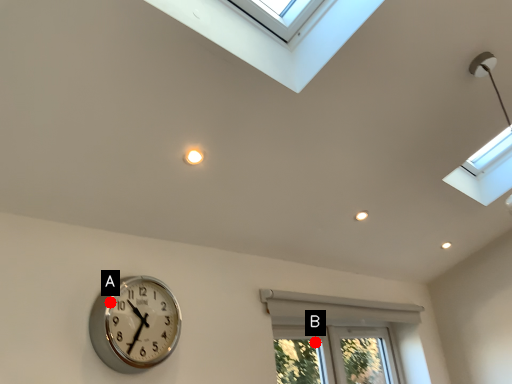
Question: Two points are circled on the image, labeled by A and B beside each circle. Which point appears closest to the camera in this image?

Choices:
 (A) A is closer
 (B) B is closer

Answer: (A)